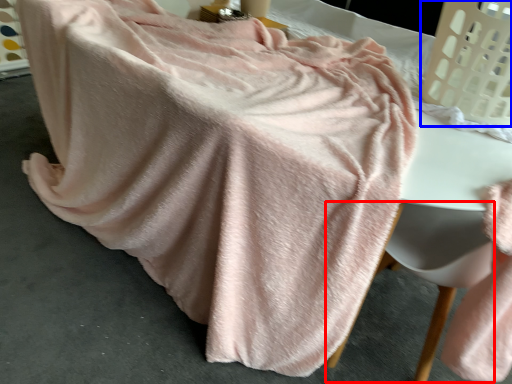
Question: Which object appears farthest to the camera in this image, swivel chair (highlighted by a red box) or laundry basket (highlighted by a blue box)?

Choices:
 (A) swivel chair
 (B) laundry basket

Answer: (B)